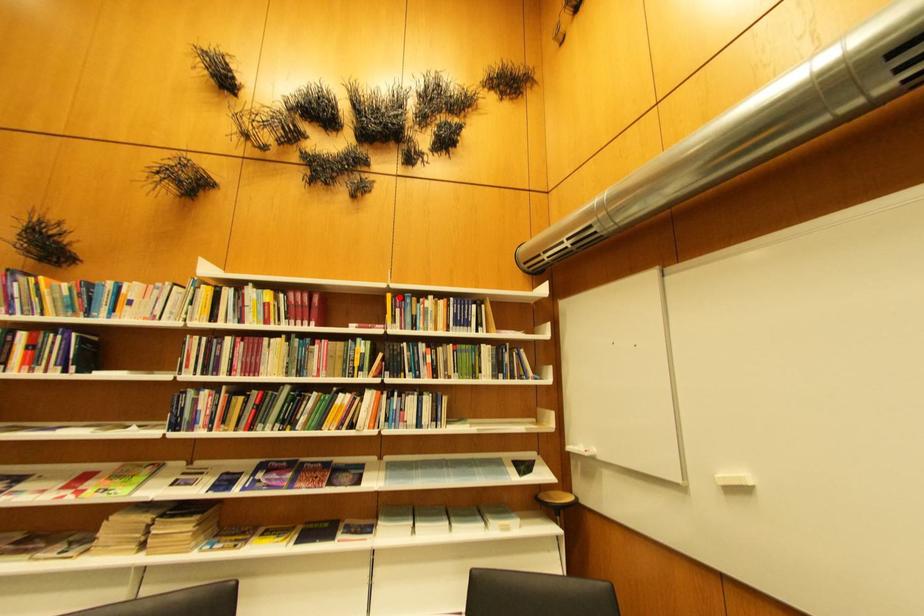
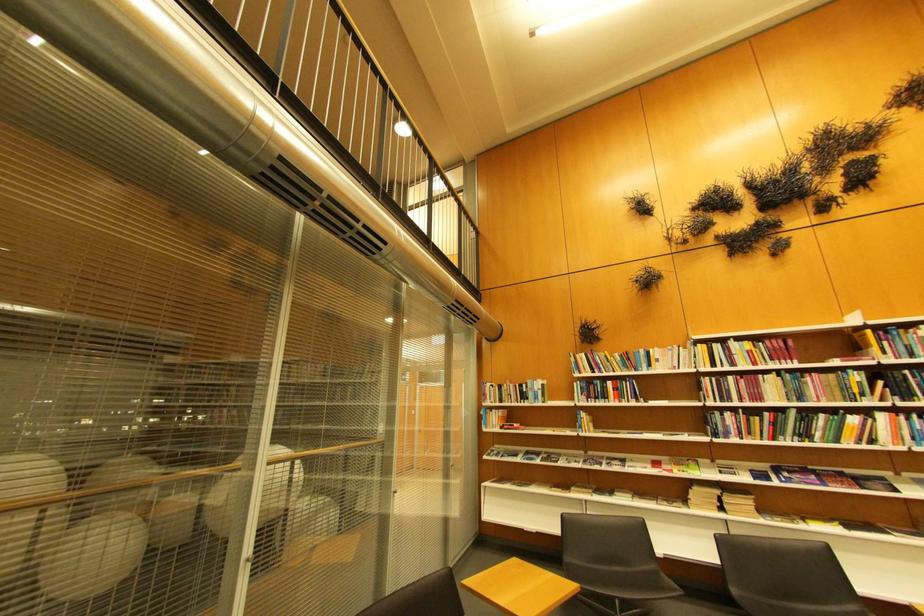
In the second image, find the point that corresponds to the highlighted location in the first image.

(880, 333)